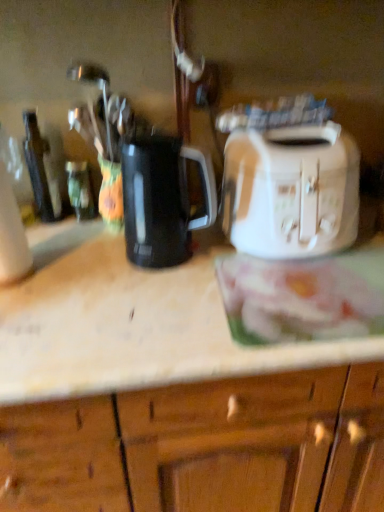
Question: Does black plastic kettle at center turn towards white glossy toaster at upper right?

Choices:
 (A) no
 (B) yes

Answer: (A)

Question: Considering the relative positions of black plastic kettle at center and white glossy toaster at upper right in the image provided, is black plastic kettle at center to the left of white glossy toaster at upper right from the viewer's perspective?

Choices:
 (A) yes
 (B) no

Answer: (A)

Question: Is black plastic kettle at center turned away from white glossy toaster at upper right?

Choices:
 (A) yes
 (B) no

Answer: (B)

Question: From the image's perspective, is black plastic kettle at center below white glossy toaster at upper right?

Choices:
 (A) yes
 (B) no

Answer: (B)

Question: Can we say black plastic kettle at center lies outside white glossy toaster at upper right?

Choices:
 (A) yes
 (B) no

Answer: (A)

Question: Considering the positions of point (76, 193) and point (38, 160), is point (76, 193) closer or farther from the camera than point (38, 160)?

Choices:
 (A) closer
 (B) farther

Answer: (B)

Question: Considering the positions of green glass bottle at left, which is counted as the 2th bottle, starting from the left, and dark brown glass bottle at left, acting as the first bottle starting from the left, in the image, is green glass bottle at left, which is counted as the 2th bottle, starting from the left, bigger or smaller than dark brown glass bottle at left, acting as the first bottle starting from the left,?

Choices:
 (A) small
 (B) big

Answer: (A)

Question: Based on their positions, is green glass bottle at left, which is counted as the 2th bottle, starting from the left, located to the left or right of dark brown glass bottle at left, acting as the first bottle starting from the left?

Choices:
 (A) left
 (B) right

Answer: (B)

Question: Would you say green glass bottle at left, the 1th bottle viewed from the right, is inside or outside dark brown glass bottle at left, which appears as the second bottle when viewed from the right?

Choices:
 (A) inside
 (B) outside

Answer: (B)

Question: From a real-world perspective, relative to green glass bottle at left, which is counted as the 2th bottle, starting from the left, is black plastic kettle at center vertically above or below?

Choices:
 (A) above
 (B) below

Answer: (A)

Question: From their relative heights in the image, would you say black plastic kettle at center is taller or shorter than green glass bottle at left, the 1th bottle viewed from the right?

Choices:
 (A) short
 (B) tall

Answer: (B)

Question: From the image's perspective, relative to green glass bottle at left, the 1th bottle viewed from the right, is black plastic kettle at center above or below?

Choices:
 (A) above
 (B) below

Answer: (B)

Question: Considering the positions of black plastic kettle at center and green glass bottle at left, the 1th bottle viewed from the right, in the image, is black plastic kettle at center wider or thinner than green glass bottle at left, the 1th bottle viewed from the right,?

Choices:
 (A) thin
 (B) wide

Answer: (B)

Question: From the image's perspective, relative to white plastic toaster at right, is white glossy bread at center above or below?

Choices:
 (A) below
 (B) above

Answer: (A)

Question: In the image, is white glossy bread at center positioned in front of or behind white plastic toaster at right?

Choices:
 (A) behind
 (B) front

Answer: (B)